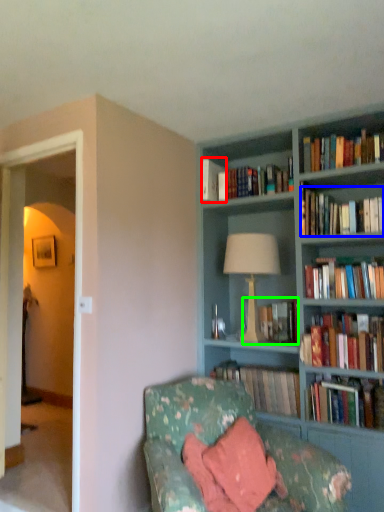
Question: Considering the real-world distances, which object is closest to book (highlighted by a red box)? book (highlighted by a blue box) or book (highlighted by a green box).

Choices:
 (A) book
 (B) book

Answer: (A)